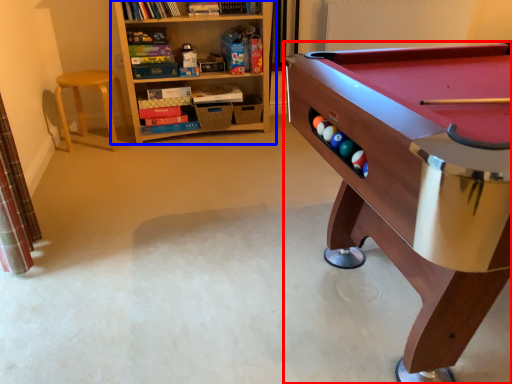
Question: Which object appears closest to the camera in this image, table (highlighted by a red box) or bookcase (highlighted by a blue box)?

Choices:
 (A) table
 (B) bookcase

Answer: (A)